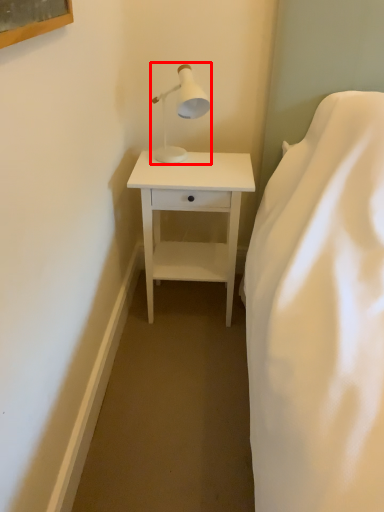
Question: In this image, where is table lamp (annotated by the red box) located relative to nightstand?

Choices:
 (A) right
 (B) left

Answer: (B)